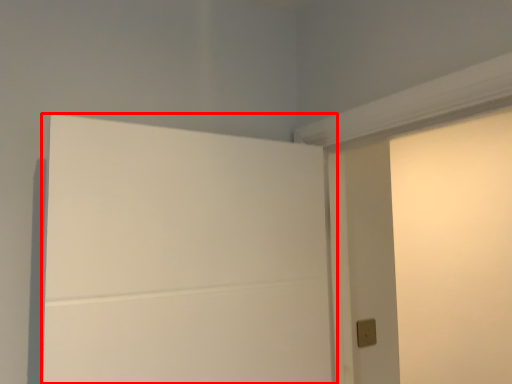
Question: Where is door (annotated by the red box) located in relation to light switch in the image?

Choices:
 (A) left
 (B) right

Answer: (A)